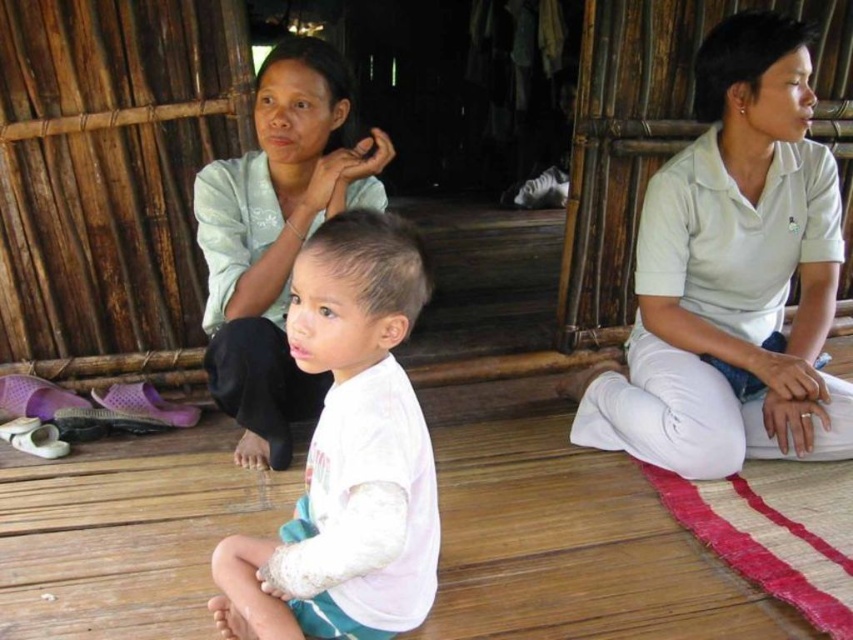
Is white cotton shirt at center shorter than white lace shirt at center?

No, white cotton shirt at center is not shorter than white lace shirt at center.

Measure the distance between point (699, 68) and camera.

A distance of 1.91 meters exists between point (699, 68) and camera.

Between point (764, 212) and point (332, 392), which one is positioned in front?

Point (332, 392) is in front.

Where is `white cotton shirt at center`? white cotton shirt at center is located at coordinates (730, 275).

The height and width of the screenshot is (640, 853). Describe the element at coordinates (730, 275) in the screenshot. I see `white cotton shirt at center` at that location.

Can you confirm if white cotton shirt at center is smaller than matte light green blouse at center?

Incorrect, white cotton shirt at center is not smaller in size than matte light green blouse at center.

The width and height of the screenshot is (853, 640). Find the location of `white cotton shirt at center`. white cotton shirt at center is located at coordinates (730, 275).

Where is `white cotton shirt at center`? white cotton shirt at center is located at coordinates (730, 275).

Can you confirm if white lace shirt at center is wider than matte light green blouse at center?

No, white lace shirt at center is not wider than matte light green blouse at center.

Does point (387, 368) come behind point (277, 99)?

No, it is in front of (277, 99).

Find the location of `white lace shirt at center`. white lace shirt at center is located at coordinates (347, 452).